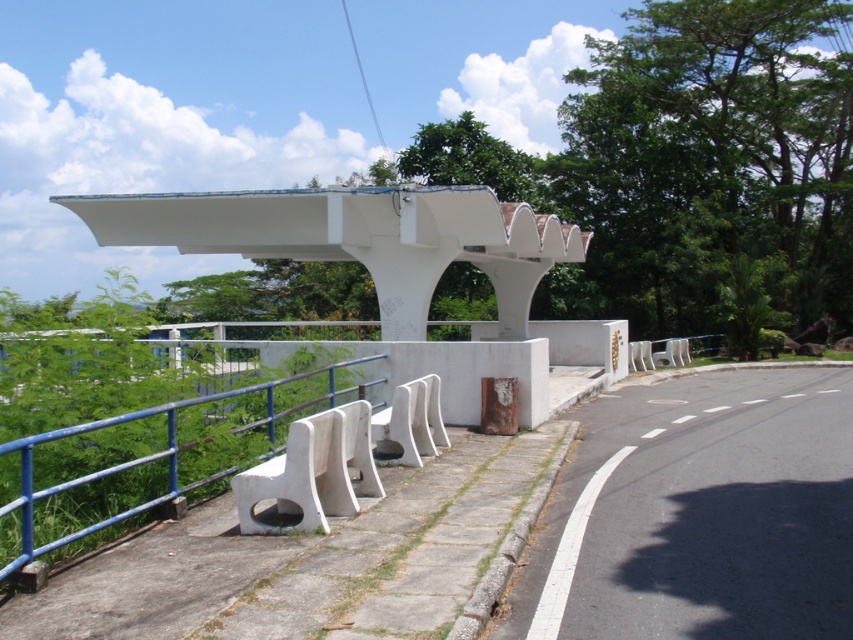
Can you confirm if white matte overpass at center is positioned below white plastic rail at lower left?

No.

Is point (215, 228) behind point (172, 483)?

Yes, it is.

Image resolution: width=853 pixels, height=640 pixels. Describe the element at coordinates (358, 237) in the screenshot. I see `white matte overpass at center` at that location.

The width and height of the screenshot is (853, 640). I want to click on white matte overpass at center, so click(358, 237).